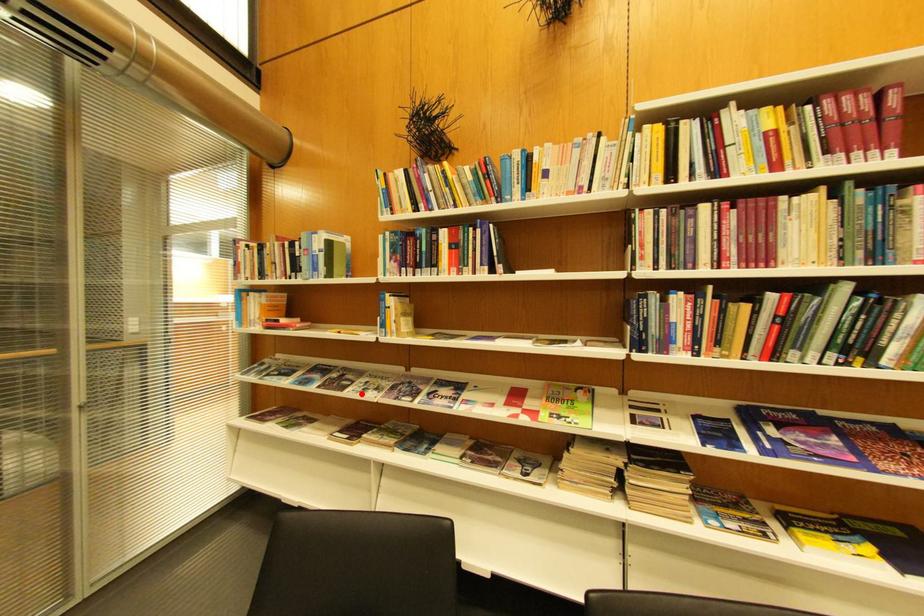
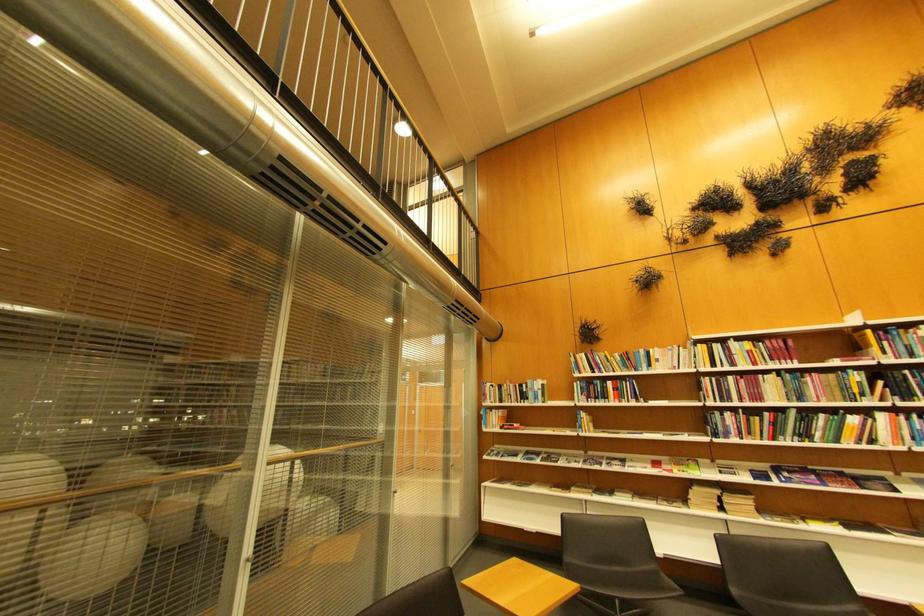
Question: I am providing you with two images of the same scene from different viewpoints. Given a red point in image1, look at the same physical point in image2. Is it:

Choices:
 (A) Closer to the viewpoint
 (B) Farther from the viewpoint

Answer: (B)